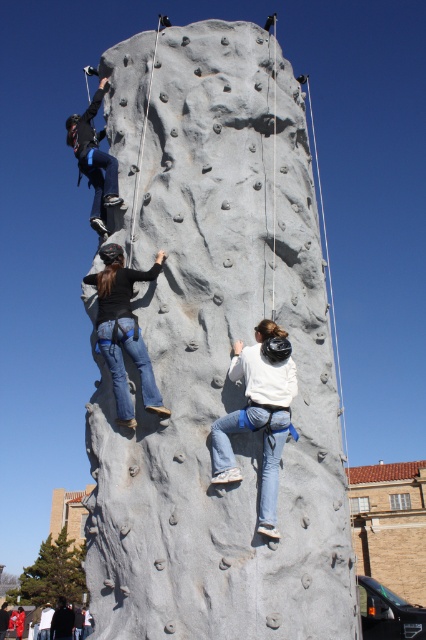
Is matte black helmet at center below matte blue pants at upper left?

Correct, matte black helmet at center is located below matte blue pants at upper left.

Which is behind, point (97, 317) or point (91, 218)?

Point (91, 218)

At what (x,y) coordinates should I click in order to perform the action: click on matte black helmet at center. Please return your answer as a coordinate pair (x, y). This screenshot has height=640, width=426. Looking at the image, I should click on (123, 330).

Between point (285, 550) and point (115, 380), which one is positioned in front?

Point (285, 550)

Does smooth concrete rock climbing at center have a greater width compared to matte black helmet at center?

Yes, smooth concrete rock climbing at center is wider than matte black helmet at center.

The image size is (426, 640). Identify the location of smooth concrete rock climbing at center. (215, 353).

This screenshot has width=426, height=640. Find the location of `smooth concrete rock climbing at center`. smooth concrete rock climbing at center is located at coordinates 215,353.

Can you confirm if smooth concrete rock climbing at center is bigger than matte blue pants at upper left?

Incorrect, smooth concrete rock climbing at center is not larger than matte blue pants at upper left.

Is smooth concrete rock climbing at center to the left of matte blue pants at upper left from the viewer's perspective?

No, smooth concrete rock climbing at center is not to the left of matte blue pants at upper left.

Identify the location of smooth concrete rock climbing at center. The image size is (426, 640). (215, 353).